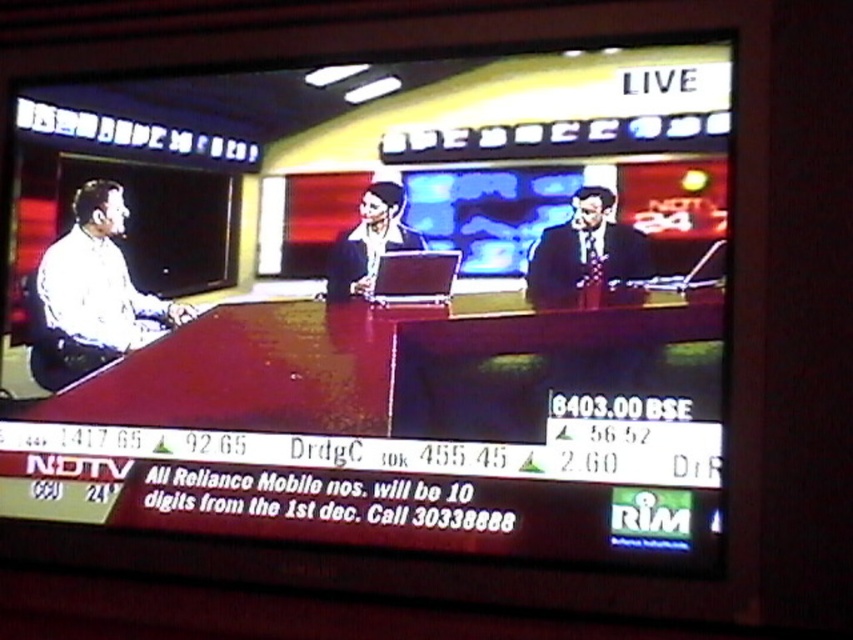
You are a camera operator filming a news segment in the studio. The director asks you to zoom in on the dark suit at center while keeping the matte wooden desk at center visible in the frame. Is this possible given their sizes?

The matte wooden desk at center is larger in size than the dark suit at center, so zooming in on the dark suit at center should still allow the matte wooden desk at center to remain visible in the frame since it occupies more space.

You are a camera operator adjusting the shot to focus on both the dark suit at center and the dark blue suit at center. Which one requires more horizontal space in the frame?

The dark suit at center might be wider than dark blue suit at center, so it requires more horizontal space in the frame to accommodate its width.